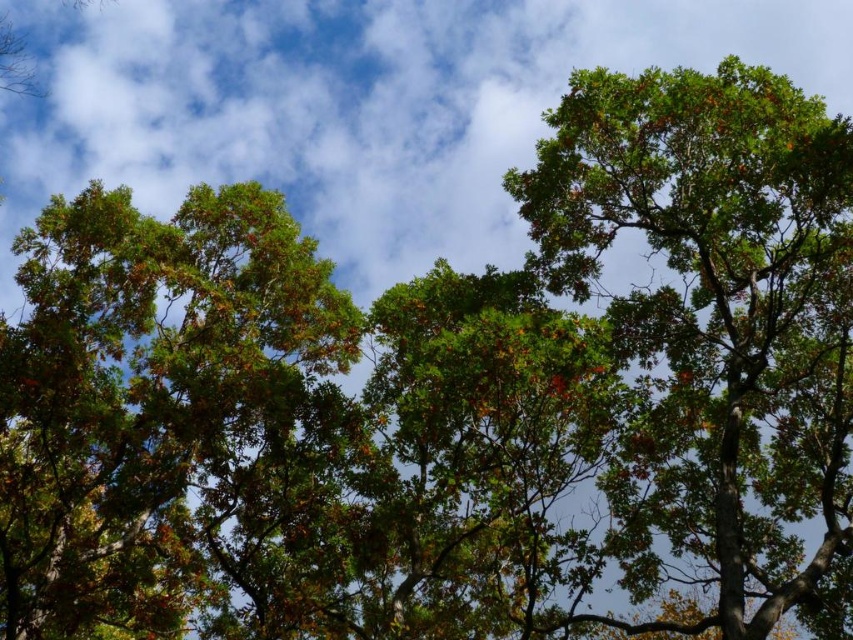
Between green leafy tree at upper left and green leafy tree at upper right, which one has less height?

green leafy tree at upper left is shorter.

Can you confirm if green leafy tree at upper left is positioned to the left of green leafy tree at upper right?

Indeed, green leafy tree at upper left is positioned on the left side of green leafy tree at upper right.

The width and height of the screenshot is (853, 640). I want to click on green leafy tree at upper left, so click(x=157, y=404).